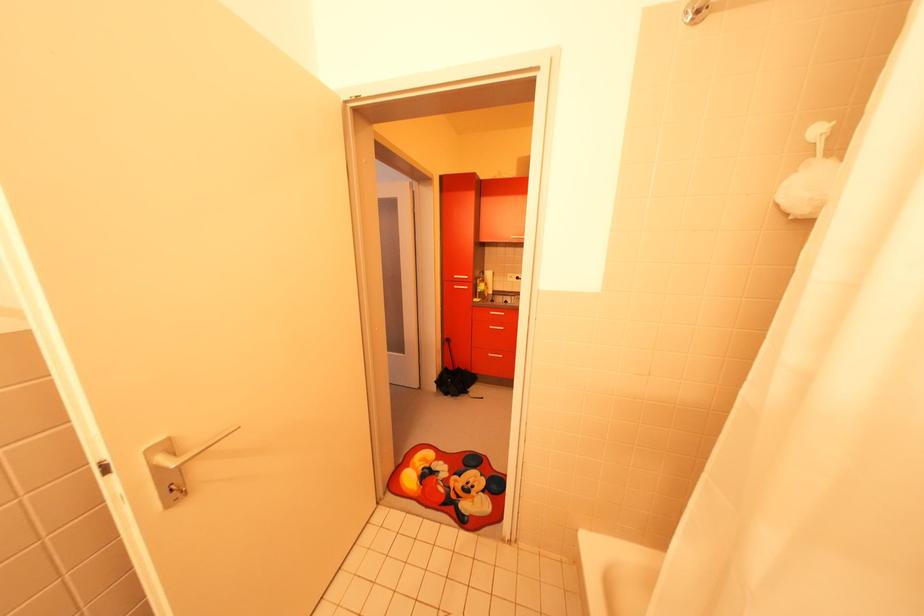
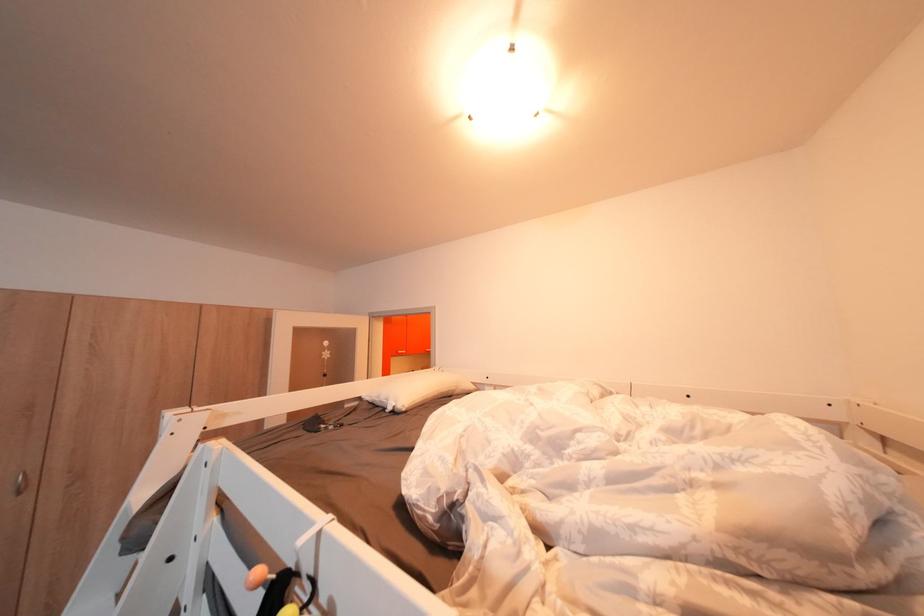
Question: I am providing you with two images of the same scene from different viewpoints. Which of the following objects are not visible in image2?

Choices:
 (A) silver cabinet handle
 (B) white pillow
 (C) silver drawer handle
 (D) transparent water pitcher

Answer: (C)